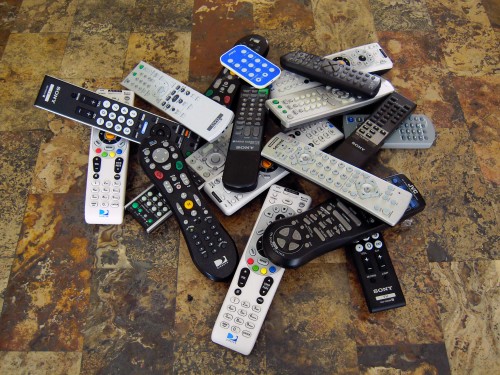
You are a GUI agent. You are given a task and a screenshot of the screen. Output one action in this format:
    pyautogui.click(x=<x>, y=<y>)
    Task: Click on the pile of remotes
    Image resolution: width=500 pixels, height=375 pixels.
    Given the screenshot: What is the action you would take?
    pyautogui.click(x=250, y=61)